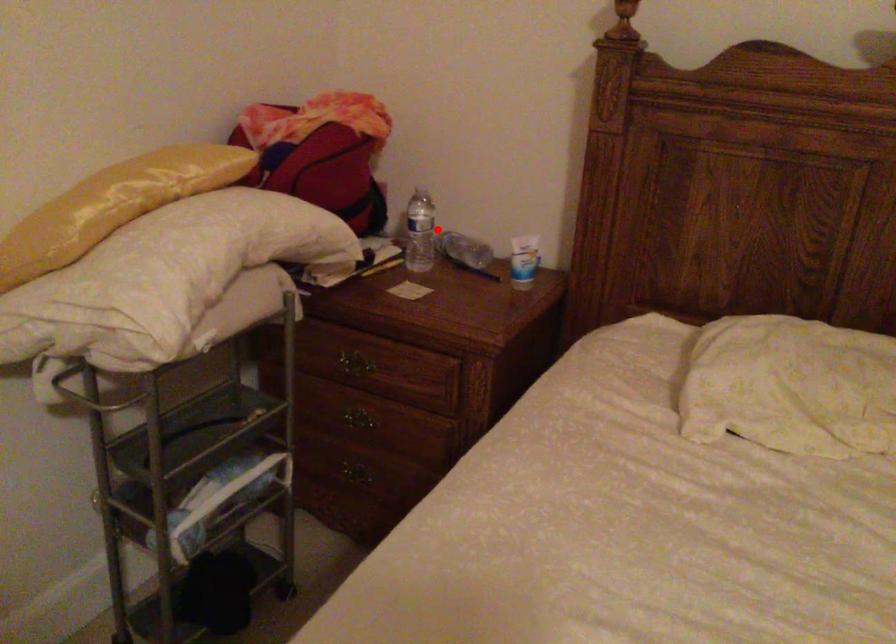
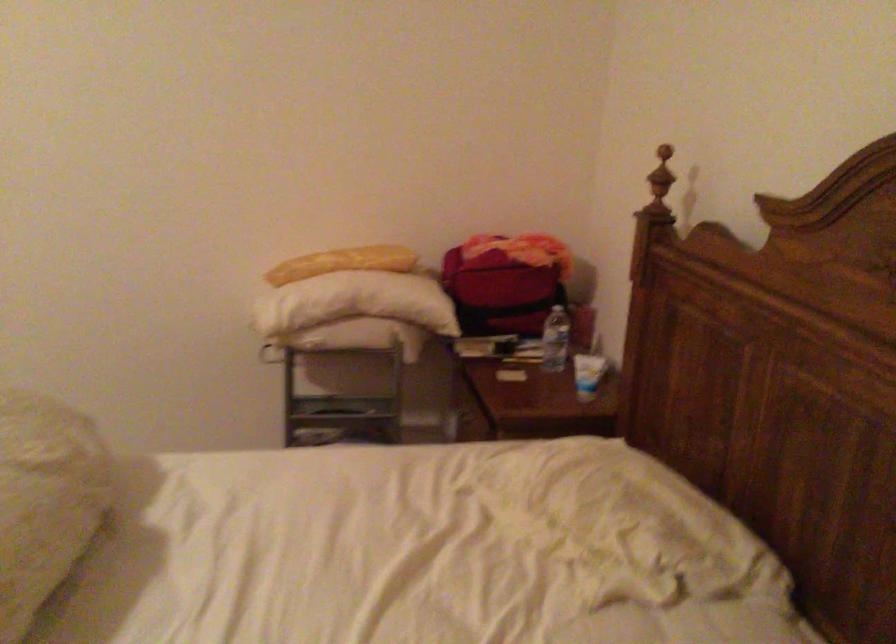
Question: I am providing you with two images of the same scene from different viewpoints. Image1 has a red point marked. In image2, the corresponding 3D location appears at what relative position? Reply with the corresponding letter.

Choices:
 (A) Closer
 (B) Farther

Answer: (B)